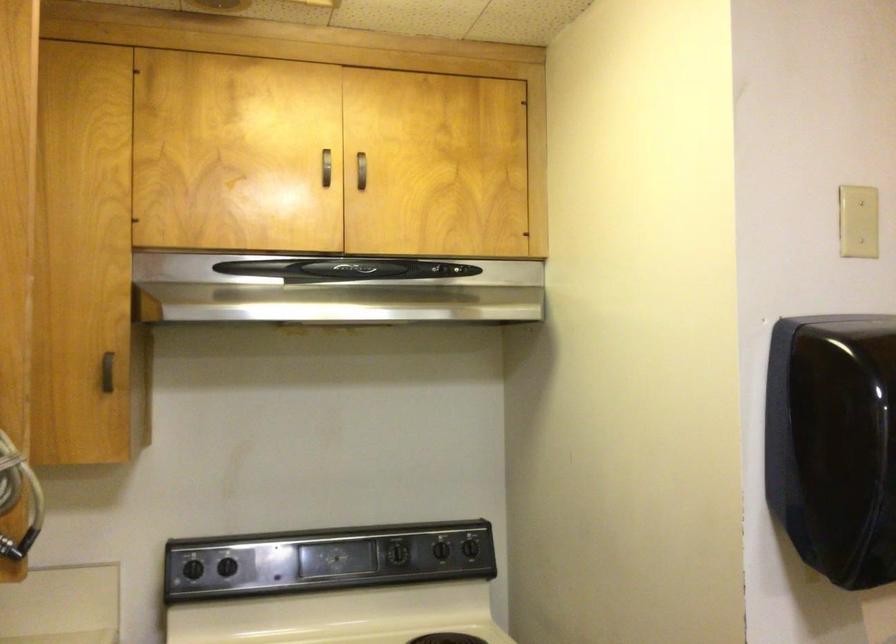
Where would you slid the range hood slider? Please return your answer as a coordinate pair (x, y).

(345, 269)